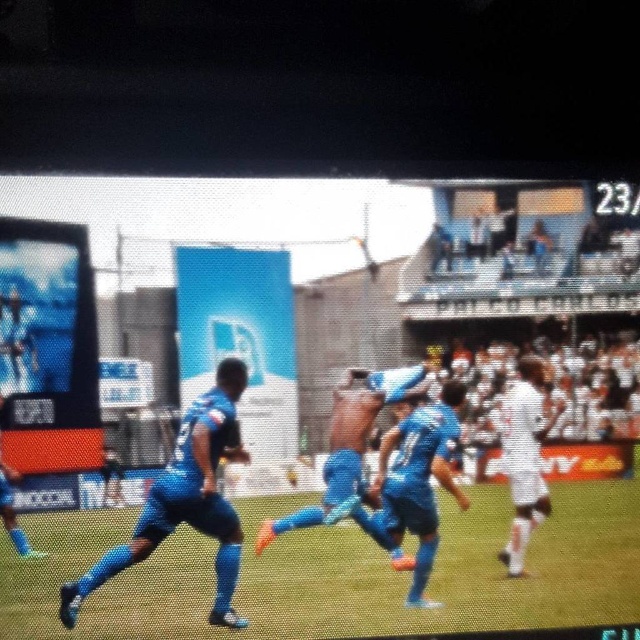
Question: Considering the relative positions of green grass football field at center and white matte jersey at right in the image provided, where is green grass football field at center located with respect to white matte jersey at right?

Choices:
 (A) right
 (B) left

Answer: (B)

Question: Which point is farther to the camera?

Choices:
 (A) (358, 372)
 (B) (403, 484)
 (C) (182, 438)
 (D) (525, 397)

Answer: (D)

Question: Estimate the real-world distances between objects in this image. Which object is farther from the white matte jersey at right?

Choices:
 (A) blue fabric shirt at center
 (B) blue matte soccer player at center
 (C) blue matte soccer player at left
 (D) blue fabric jersey at center

Answer: (C)

Question: Is green grass football field at center to the right of blue fabric shirt at center from the viewer's perspective?

Choices:
 (A) yes
 (B) no

Answer: (A)

Question: Does blue matte soccer player at left appear on the left side of blue matte soccer player at center?

Choices:
 (A) no
 (B) yes

Answer: (B)

Question: Which point is farther to the camera?

Choices:
 (A) blue matte soccer player at center
 (B) white matte jersey at right

Answer: (B)